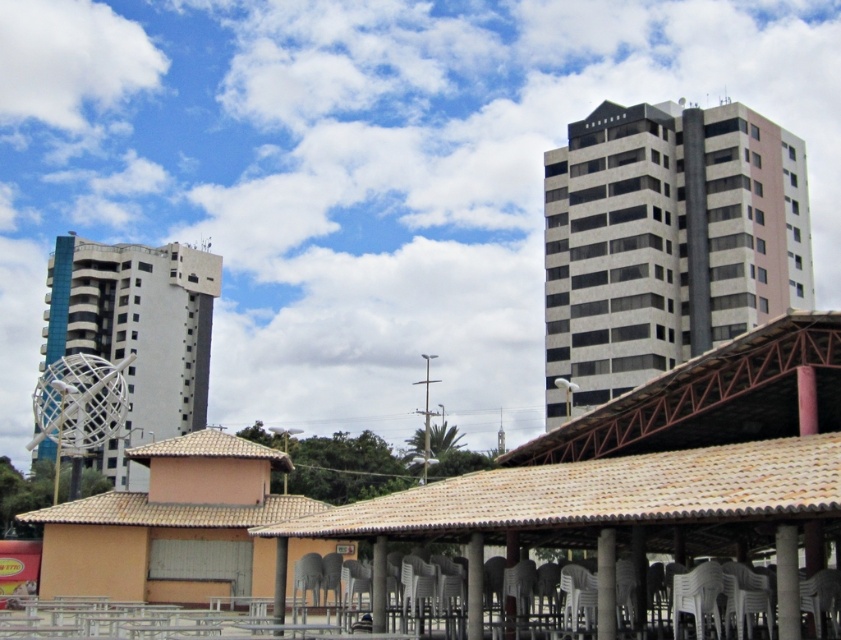
Question: Estimate the real-world distances between objects in this image. Which object is farther from the white marble building at upper right?

Choices:
 (A) white metallic sculpture at left
 (B) white glossy pillar at center
 (C) brown tile roof at lower left

Answer: (B)

Question: Among these points, which one is farthest from the camera?

Choices:
 (A) (594, 531)
 (B) (787, 576)
 (C) (279, 586)
 (D) (90, 508)

Answer: (D)

Question: Is white marble building at upper right above white metallic sculpture at left?

Choices:
 (A) no
 (B) yes

Answer: (B)

Question: Where is gray concrete pillar at lower center located in relation to white glossy pillar at center in the image?

Choices:
 (A) below
 (B) above

Answer: (B)

Question: Does white metallic sculpture at left appear under gray concrete pillar at lower center?

Choices:
 (A) yes
 (B) no

Answer: (A)

Question: Which object appears closest to the camera in this image?

Choices:
 (A) white glossy pillar at lower right
 (B) white plastic pillar at center
 (C) yellow matte building at lower left
 (D) gray concrete pillar at lower center

Answer: (A)